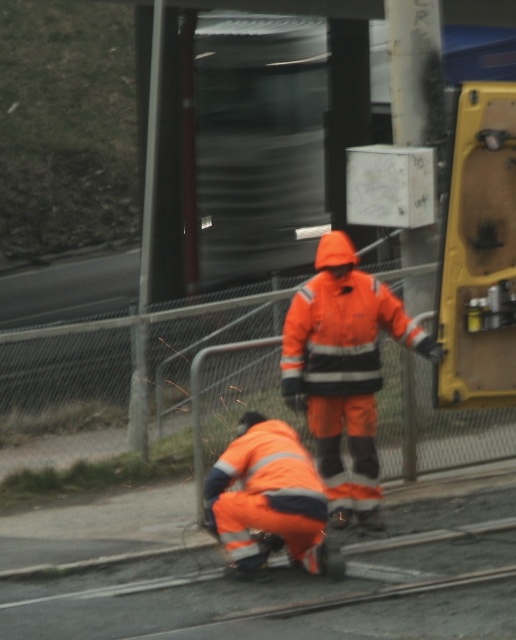
Is orange reflective suit at center thinner than reflective orange jumpsuit at lower center?

Incorrect, orange reflective suit at center's width is not less than reflective orange jumpsuit at lower center's.

Can you confirm if orange reflective suit at center is smaller than reflective orange jumpsuit at lower center?

Actually, orange reflective suit at center might be larger than reflective orange jumpsuit at lower center.

At what (x,y) coordinates should I click in order to perform the action: click on orange reflective suit at center. Please return your answer as a coordinate pair (x, y). This screenshot has width=516, height=640. Looking at the image, I should click on (344, 369).